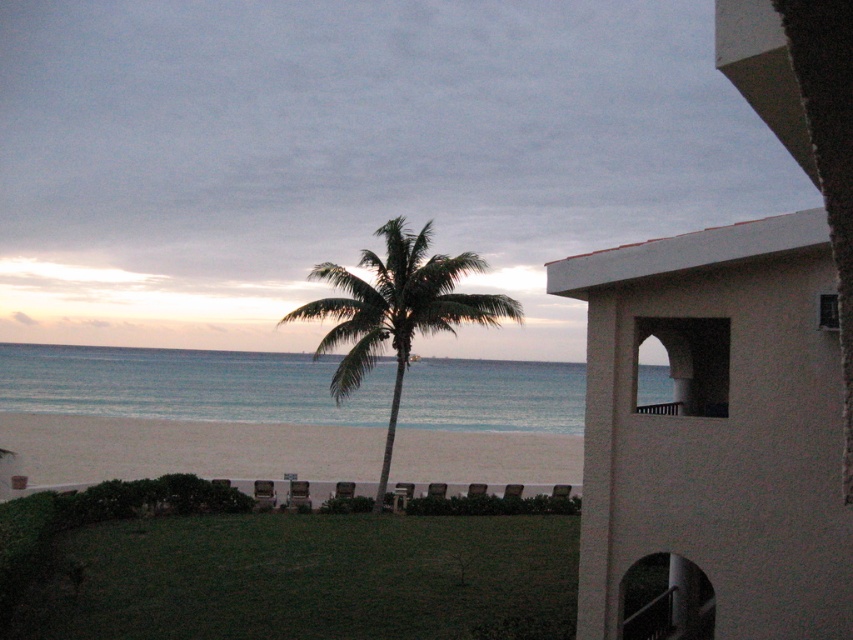
Question: Which of these objects is positioned farthest from the white sand beach at lower center?

Choices:
 (A) blue water at center
 (B) white stucco building at right
 (C) green leafy palm tree at center

Answer: (B)

Question: Which object is closer to the camera taking this photo?

Choices:
 (A) green leafy palm tree at center
 (B) white sand beach at lower center

Answer: (A)

Question: Is white stucco building at right above blue water at center?

Choices:
 (A) yes
 (B) no

Answer: (A)

Question: Can you confirm if white sand beach at lower center is wider than green leafy palm tree at center?

Choices:
 (A) no
 (B) yes

Answer: (B)

Question: Which object appears closest to the camera in this image?

Choices:
 (A) green leafy palm tree at center
 (B) blue water at center

Answer: (B)

Question: Is white stucco building at right to the right of white sand beach at lower center from the viewer's perspective?

Choices:
 (A) yes
 (B) no

Answer: (A)